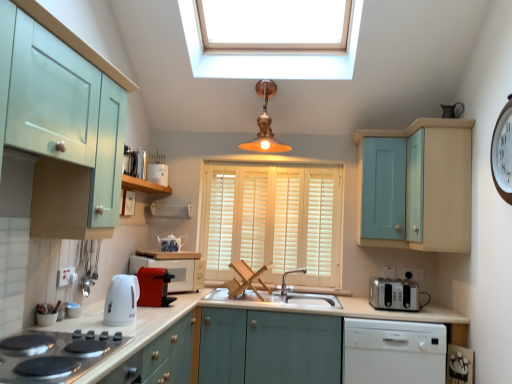
Where is `free space on the front side of red plastic coffee machine at center`? free space on the front side of red plastic coffee machine at center is located at coordinates (151, 312).